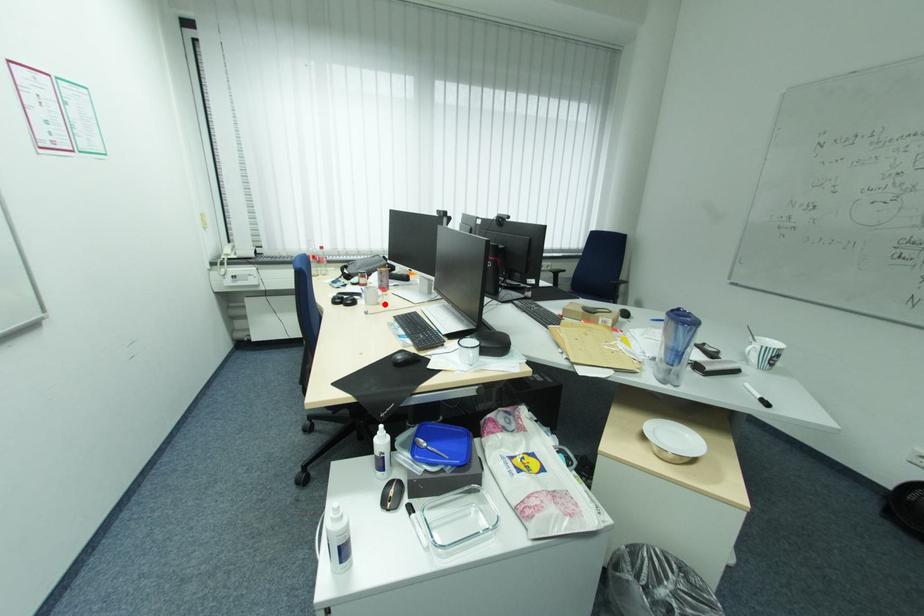
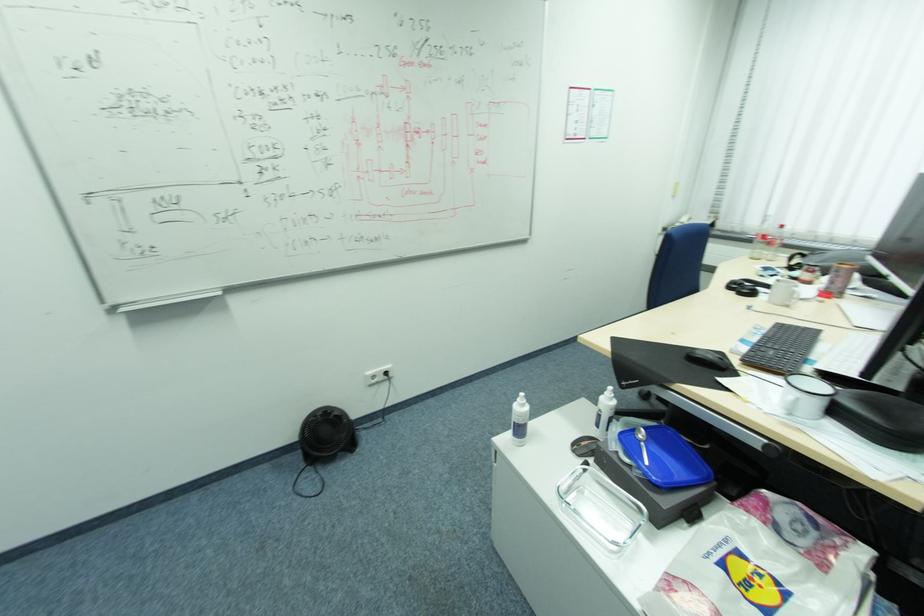
Where in the second image is the point corresponding to the highlighted location from the first image?

(792, 307)